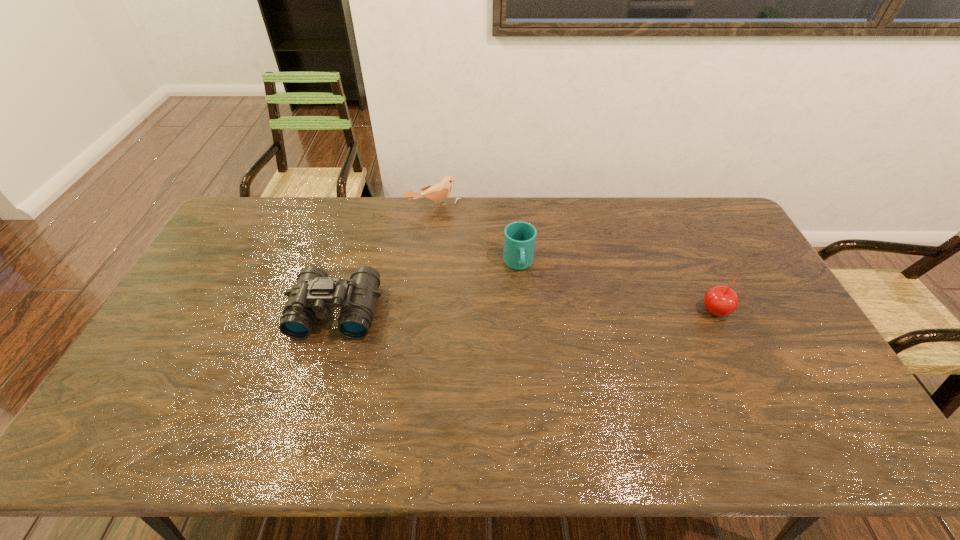
Where is `vacant spot on the desktop that is between the leftmost object and the cherry and is positioned on the handle side of the third nearest object`? The image size is (960, 540). vacant spot on the desktop that is between the leftmost object and the cherry and is positioned on the handle side of the third nearest object is located at coordinates (527, 311).

At what (x,y) coordinates should I click in order to perform the action: click on free spot on the desktop that is between the leftmost object and the cherry and is positioned at the beak of the farthest object. Please return your answer as a coordinate pair (x, y). Looking at the image, I should click on (498, 311).